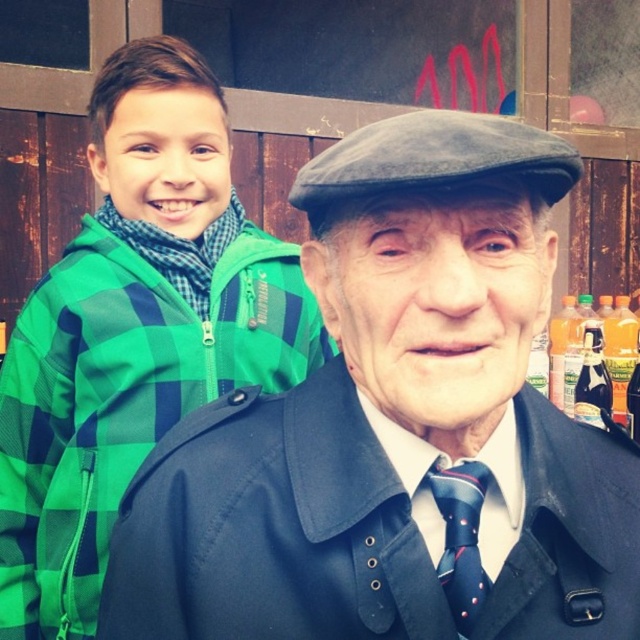
Question: Which object is the closest to the green checkered jacket at left?

Choices:
 (A) dark blue silk tie at center
 (B) matte black coat at center

Answer: (B)

Question: Estimate the real-world distances between objects in this image. Which object is farther from the dark blue silk tie at center?

Choices:
 (A) green checkered jacket at left
 (B) matte black coat at center

Answer: (A)

Question: Is matte black coat at center above green checkered jacket at left?

Choices:
 (A) yes
 (B) no

Answer: (B)

Question: From the image, what is the correct spatial relationship of matte black coat at center in relation to green checkered jacket at left?

Choices:
 (A) above
 (B) below

Answer: (B)

Question: Is matte black coat at center to the left of dark blue silk tie at center from the viewer's perspective?

Choices:
 (A) no
 (B) yes

Answer: (A)

Question: Which point is closer to the camera?

Choices:
 (A) [74, 292]
 (B) [452, 563]

Answer: (B)